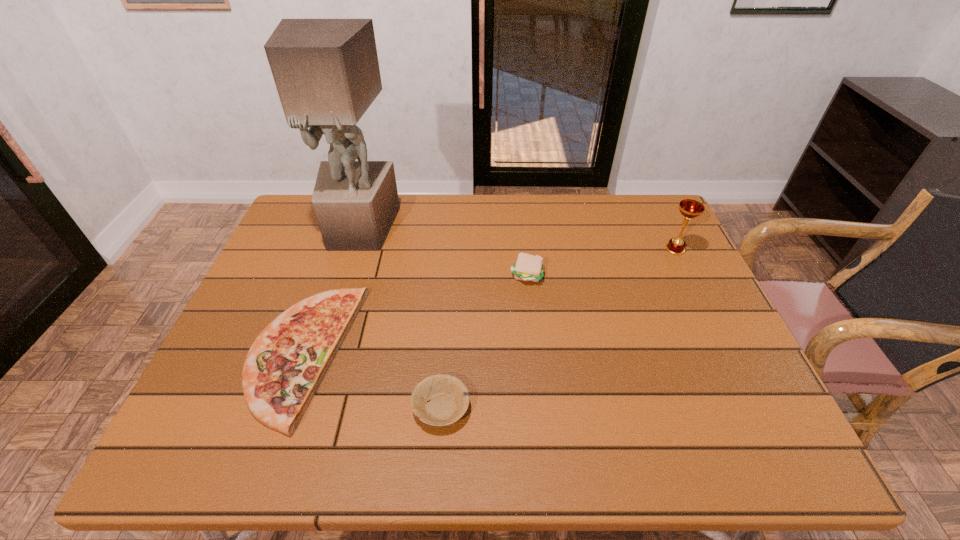
Where is `free point that satisfies the following two spatial constraints: 1. on the front-facing side of the bowl; 2. on the left side of the tallest object`? free point that satisfies the following two spatial constraints: 1. on the front-facing side of the bowl; 2. on the left side of the tallest object is located at coordinates (303, 408).

At what (x,y) coordinates should I click in order to perform the action: click on free space that satisfies the following two spatial constraints: 1. on the front-facing side of the sculpture; 2. on the right side of the fourth shortest object. Please return your answer as a coordinate pair (x, y). Looking at the image, I should click on (353, 249).

Find the location of a particular element. This screenshot has width=960, height=540. vacant space that satisfies the following two spatial constraints: 1. on the front-facing side of the third farthest object; 2. on the left side of the tallest object is located at coordinates (346, 275).

This screenshot has width=960, height=540. I want to click on vacant region that satisfies the following two spatial constraints: 1. on the back side of the patty; 2. on the right side of the rightmost object, so click(x=524, y=249).